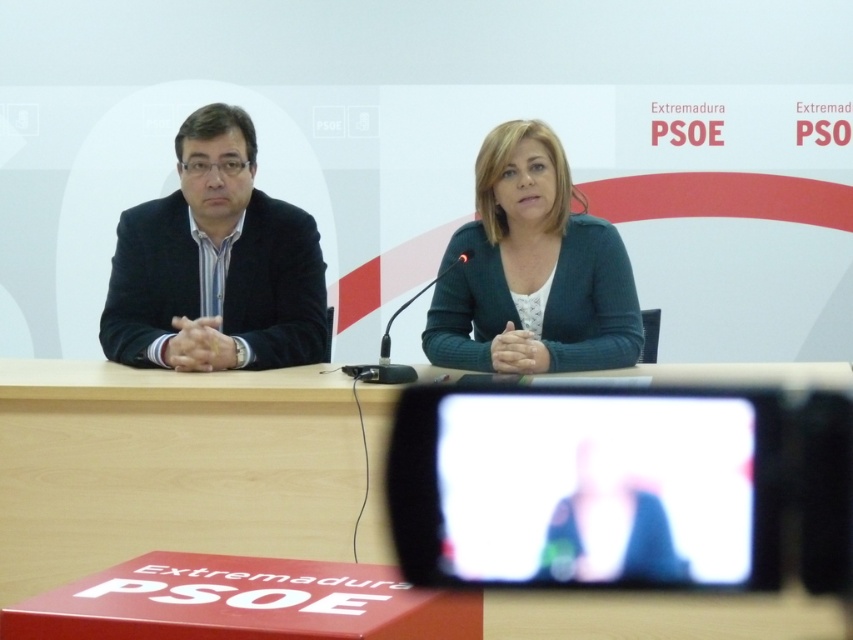
Question: Among these objects, which one is nearest to the camera?

Choices:
 (A) white glossy monitor at center
 (B) green knitted cardigan at center
 (C) wooden table at center

Answer: (A)

Question: Among these points, which one is farthest from the camera?

Choices:
 (A) (561, 266)
 (B) (341, 435)

Answer: (A)

Question: Can you confirm if wooden table at center is positioned to the left of green knitted cardigan at center?

Choices:
 (A) no
 (B) yes

Answer: (B)

Question: Which object appears farthest from the camera in this image?

Choices:
 (A) matte black suit at left
 (B) white glossy monitor at center

Answer: (A)

Question: Does white glossy monitor at center have a larger size compared to green knitted cardigan at center?

Choices:
 (A) yes
 (B) no

Answer: (B)

Question: Can you confirm if white glossy monitor at center is smaller than matte black suit at left?

Choices:
 (A) yes
 (B) no

Answer: (A)